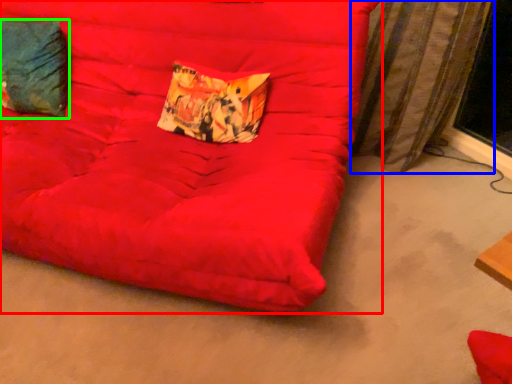
Question: Considering the real-world distances, which object is farthest from furniture (highlighted by a red box)? curtain (highlighted by a blue box) or pillow (highlighted by a green box)?

Choices:
 (A) curtain
 (B) pillow

Answer: (A)